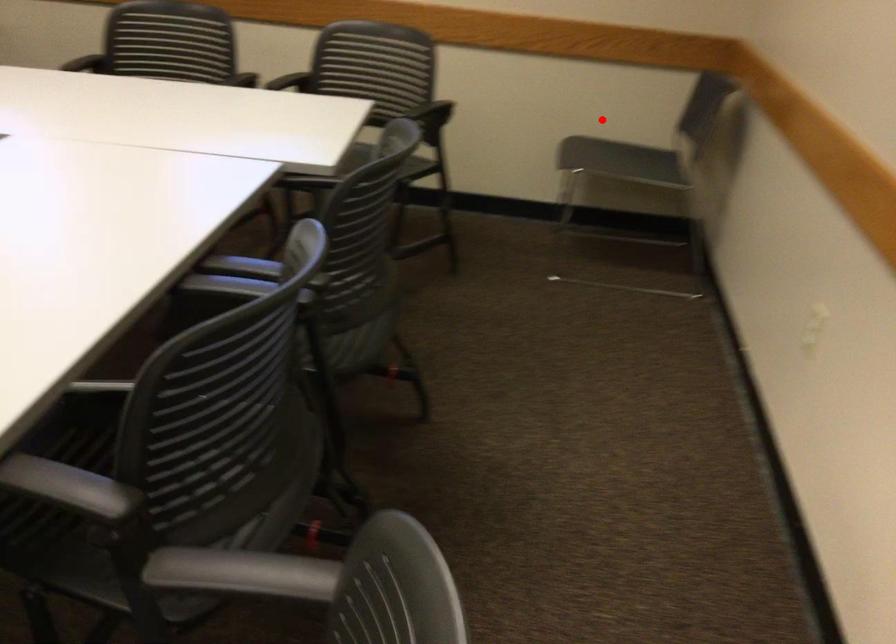
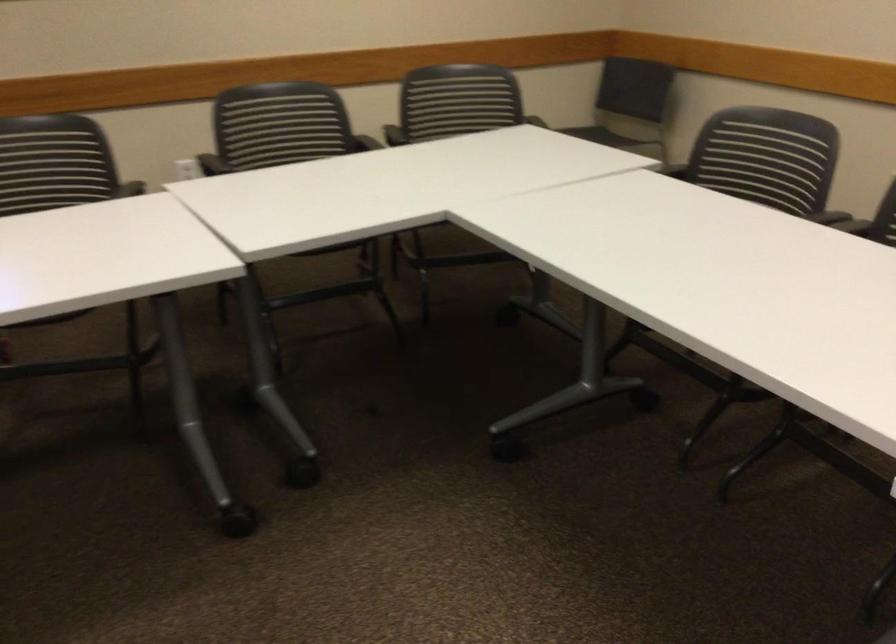
Question: I am providing you with two images of the same scene from different viewpoints. Given a red point in image1, look at the same physical point in image2. Is it:

Choices:
 (A) Closer to the viewpoint
 (B) Farther from the viewpoint

Answer: (B)